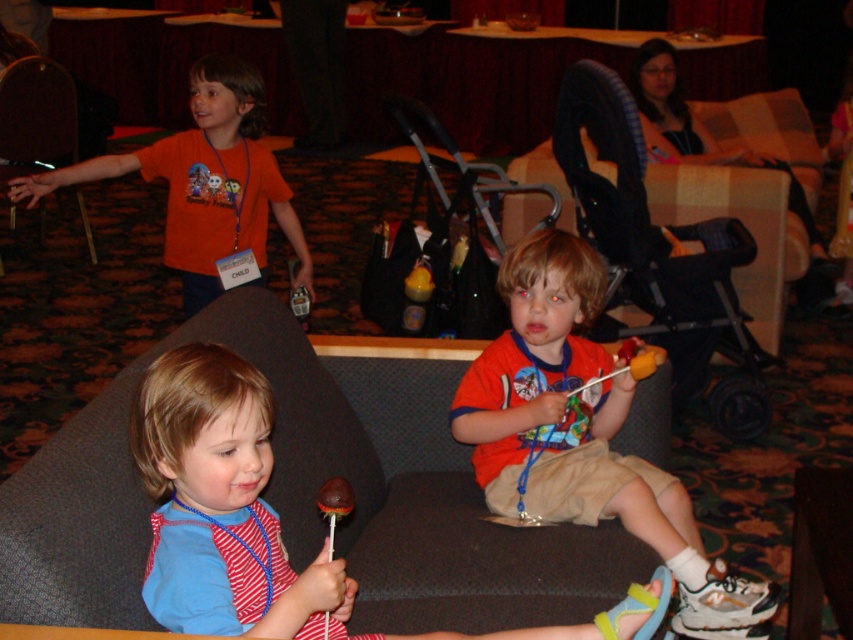
Is the position of matte red shirt at center less distant than that of wooden chair at left?

That is True.

Which is more to the left, matte red shirt at center or wooden chair at left?

Positioned to the left is wooden chair at left.

Between point (688, 604) and point (0, 150), which one is positioned in front?

Positioned in front is point (688, 604).

I want to click on matte red shirt at center, so click(583, 433).

How far apart are black plastic stroller at center and wooden chair at left?

black plastic stroller at center and wooden chair at left are 10.09 feet apart.

Measure the distance between point (701, 296) and camera.

Point (701, 296) is 10.07 feet from camera.

At what (x,y) coordinates should I click in order to perform the action: click on black plastic stroller at center. Please return your answer as a coordinate pair (x, y). Looking at the image, I should click on (660, 252).

Does point (657, 499) come farther from viewer compared to point (733, 314)?

No, (657, 499) is in front of (733, 314).

The width and height of the screenshot is (853, 640). Describe the element at coordinates (583, 433) in the screenshot. I see `matte red shirt at center` at that location.

The image size is (853, 640). I want to click on matte red shirt at center, so click(x=583, y=433).